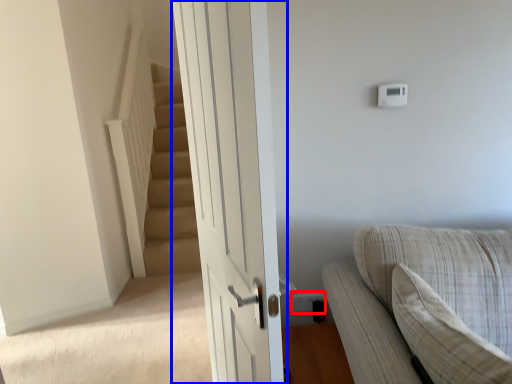
Question: Which object appears closest to the camera in this image, electric outlet (highlighted by a red box) or door (highlighted by a blue box)?

Choices:
 (A) electric outlet
 (B) door

Answer: (B)